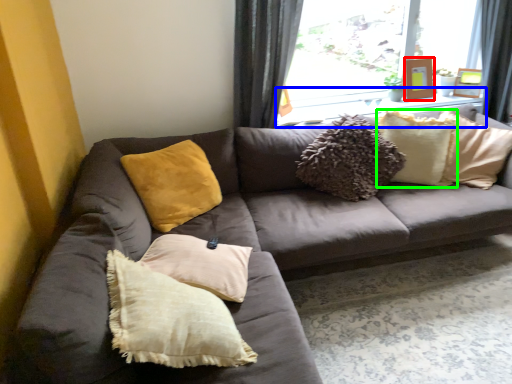
Question: Estimate the real-world distances between objects in this image. Which object is closer to picture frame (highlighted by a red box), window sill (highlighted by a blue box) or pillow (highlighted by a green box)?

Choices:
 (A) window sill
 (B) pillow

Answer: (A)